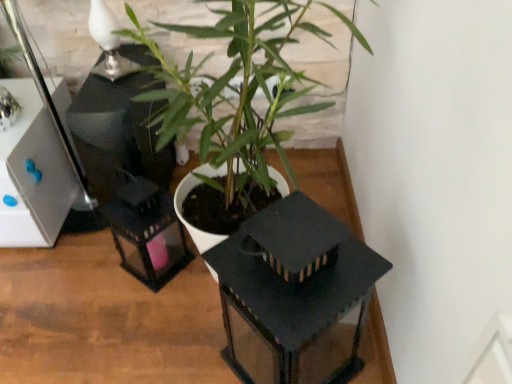
The image size is (512, 384). I want to click on matte black lantern at center, so click(x=105, y=319).

Identify the location of white glossy table lamp at upper left. This screenshot has width=512, height=384. (108, 42).

You are a GUI agent. You are given a task and a screenshot of the screen. Output one action in this format:
    pyautogui.click(x=<x>, y=<y>)
    Task: Click on the green matte plant at center
    The width and height of the screenshot is (512, 384).
    Given the screenshot: What is the action you would take?
    pyautogui.click(x=233, y=90)

Does green matte plant at center have a smaller size compared to matte black lantern at center?

No.

From a real-world perspective, is green matte plant at center physically above matte black lantern at center?

Indeed, from a real-world perspective, green matte plant at center stands above matte black lantern at center.

From the image's perspective, is green matte plant at center above or below matte black lantern at center?

From the image's perspective, green matte plant at center appears above matte black lantern at center.

From the picture: Which object is wider, green matte plant at center or matte black lantern at center?

matte black lantern at center is wider.

Can you tell me how much matte black lantern at center and green matte plant at center differ in facing direction?

They differ by 89.6 degrees in their facing directions.

Between matte black lantern at center and green matte plant at center, which one has larger width?

Wider between the two is matte black lantern at center.

Is matte black lantern at center to the left or to the right of green matte plant at center in the image?

In the image, matte black lantern at center appears on the left side of green matte plant at center.

Would you say matte black lantern at center is inside or outside green matte plant at center?

matte black lantern at center exists outside the volume of green matte plant at center.

The width and height of the screenshot is (512, 384). Find the location of `table lamp located on the left of green matte plant at center`. table lamp located on the left of green matte plant at center is located at coordinates (108, 42).

Is white glossy table lamp at upper left wider than green matte plant at center?

Incorrect, the width of white glossy table lamp at upper left does not surpass that of green matte plant at center.

In terms of size, does white glossy table lamp at upper left appear bigger or smaller than green matte plant at center?

Considering their sizes, white glossy table lamp at upper left takes up less space than green matte plant at center.

From a real-world perspective, which is physically above, white glossy table lamp at upper left or green matte plant at center?

white glossy table lamp at upper left.

Is green matte plant at center directly adjacent to white glossy table lamp at upper left?

green matte plant at center and white glossy table lamp at upper left are clearly separated.

Which point is more forward, (262, 161) or (121, 62)?

The point (262, 161) is closer to the camera.

Considering the relative sizes of green matte plant at center and white glossy table lamp at upper left in the image provided, is green matte plant at center bigger than white glossy table lamp at upper left?

Yes, green matte plant at center is bigger than white glossy table lamp at upper left.

How much distance is there between green matte plant at center and white glossy table lamp at upper left?

green matte plant at center is 13.02 inches away from white glossy table lamp at upper left.

Can you confirm if matte black lantern at center is taller than white glossy table lamp at upper left?

No.

From the image's perspective, is matte black lantern at center above white glossy table lamp at upper left?

No, from the image's perspective, matte black lantern at center is not on top of white glossy table lamp at upper left.

Does matte black lantern at center turn towards white glossy table lamp at upper left?

No, matte black lantern at center is not aimed at white glossy table lamp at upper left.

Which object is more forward, matte black lantern at center or white glossy table lamp at upper left?

matte black lantern at center is closer to the camera.

Is white glossy table lamp at upper left bigger or smaller than matte black lantern at center?

In the image, white glossy table lamp at upper left appears to be smaller than matte black lantern at center.

Looking at this image, from the image's perspective, which one is positioned higher, white glossy table lamp at upper left or matte black lantern at center?

From the image's view, white glossy table lamp at upper left is above.

Find the location of a particular element. table below the white glossy table lamp at upper left (from a real-world perspective) is located at coordinates (105, 319).

Is white glossy table lamp at upper left aimed at matte black lantern at center?

No, white glossy table lamp at upper left does not turn towards matte black lantern at center.

Where is `houseplant on the right of the matte black lantern at center`? houseplant on the right of the matte black lantern at center is located at coordinates (233, 90).

What are the coordinates of `table on the left of the green matte plant at center` in the screenshot? It's located at (105, 319).

Based on their spatial positions, is green matte plant at center or white glossy table lamp at upper left further from matte black lantern at center?

The object further to matte black lantern at center is white glossy table lamp at upper left.

Which object lies further to the anchor point white glossy table lamp at upper left, matte black lantern at center or green matte plant at center?

The object further to white glossy table lamp at upper left is matte black lantern at center.

Considering their positions, is green matte plant at center positioned further to white glossy table lamp at upper left than matte black lantern at center?

The object further to white glossy table lamp at upper left is matte black lantern at center.

When comparing their distances from matte black lantern at center, does white glossy table lamp at upper left or green matte plant at center seem further?

white glossy table lamp at upper left is further to matte black lantern at center.

When comparing their distances from green matte plant at center, does matte black lantern at center or white glossy table lamp at upper left seem further?

The object further to green matte plant at center is matte black lantern at center.

When comparing their distances from green matte plant at center, does white glossy table lamp at upper left or matte black lantern at center seem closer?

white glossy table lamp at upper left is closer to green matte plant at center.

This screenshot has width=512, height=384. In order to click on houseplant between white glossy table lamp at upper left and matte black lantern at center vertically in this screenshot , I will do `click(233, 90)`.